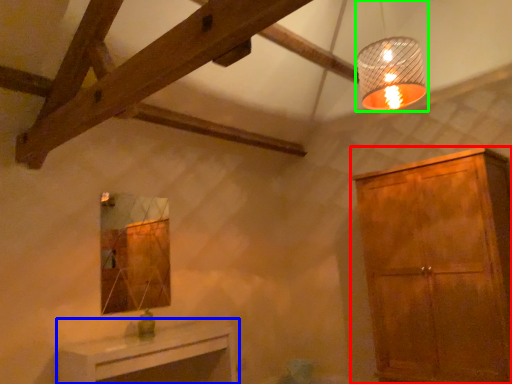
Question: Which is nearer to the cabinetry (highlighted by a red box)? table (highlighted by a blue box) or lamp (highlighted by a green box).

Choices:
 (A) table
 (B) lamp

Answer: (B)